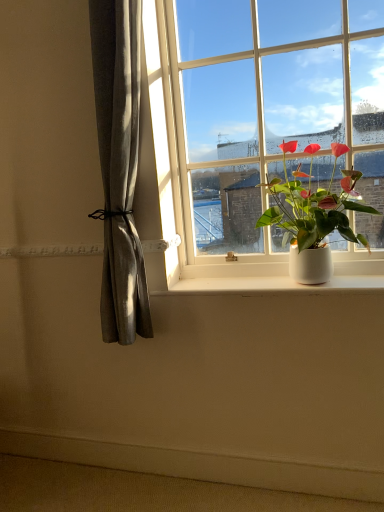
Where is `free region under white smooth ledge at lower center (from a real-world perspective)`? This screenshot has width=384, height=512. free region under white smooth ledge at lower center (from a real-world perspective) is located at coordinates (155, 474).